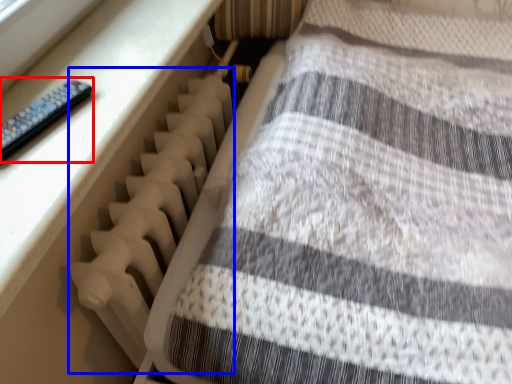
Question: Which object appears closest to the camera in this image, control (highlighted by a red box) or radiator (highlighted by a blue box)?

Choices:
 (A) control
 (B) radiator

Answer: (A)